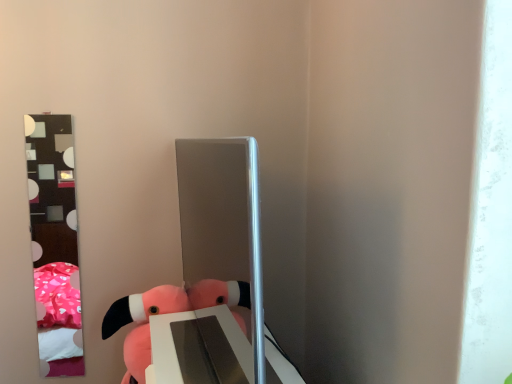
Question: From the image's perspective, does metallic reflective mirror at left appear higher than pink plush toy at lower left?

Choices:
 (A) no
 (B) yes

Answer: (B)

Question: From a real-world perspective, is metallic reflective mirror at left on pink plush toy at lower left?

Choices:
 (A) yes
 (B) no

Answer: (A)

Question: Can you see metallic reflective mirror at left touching pink plush toy at lower left?

Choices:
 (A) no
 (B) yes

Answer: (A)

Question: Can you confirm if metallic reflective mirror at left is taller than pink plush toy at lower left?

Choices:
 (A) yes
 (B) no

Answer: (A)

Question: Is metallic reflective mirror at left in front of pink plush toy at lower left?

Choices:
 (A) yes
 (B) no

Answer: (B)

Question: Considering the positions of satin silver mirror at center and pink plush toy at lower left in the image, is satin silver mirror at center wider or thinner than pink plush toy at lower left?

Choices:
 (A) wide
 (B) thin

Answer: (B)

Question: In the image, is satin silver mirror at center positioned in front of or behind pink plush toy at lower left?

Choices:
 (A) front
 (B) behind

Answer: (A)

Question: From a real-world perspective, is satin silver mirror at center positioned above or below pink plush toy at lower left?

Choices:
 (A) above
 (B) below

Answer: (A)

Question: Looking at the image, does satin silver mirror at center seem bigger or smaller compared to pink plush toy at lower left?

Choices:
 (A) small
 (B) big

Answer: (B)

Question: In terms of height, does satin silver mirror at center look taller or shorter compared to metallic reflective mirror at left?

Choices:
 (A) short
 (B) tall

Answer: (A)

Question: In terms of width, does satin silver mirror at center look wider or thinner when compared to metallic reflective mirror at left?

Choices:
 (A) wide
 (B) thin

Answer: (A)

Question: From the image's perspective, relative to metallic reflective mirror at left, is satin silver mirror at center above or below?

Choices:
 (A) above
 (B) below

Answer: (A)

Question: Choose the correct answer: Is satin silver mirror at center inside metallic reflective mirror at left or outside it?

Choices:
 (A) outside
 (B) inside

Answer: (A)

Question: From the image's perspective, relative to satin silver mirror at center, is pink plush toy at lower left above or below?

Choices:
 (A) above
 (B) below

Answer: (B)

Question: Would you say pink plush toy at lower left is inside or outside satin silver mirror at center?

Choices:
 (A) outside
 (B) inside

Answer: (A)